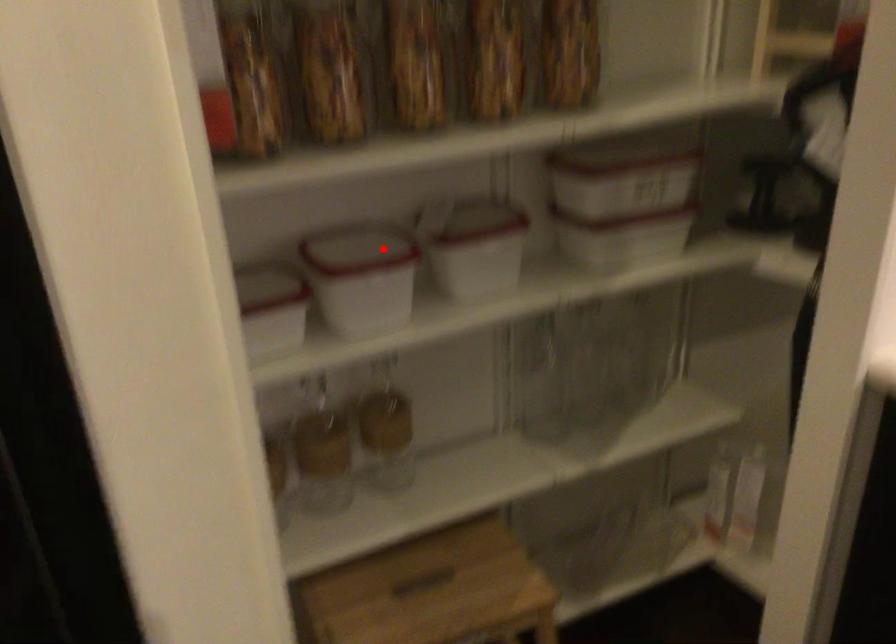
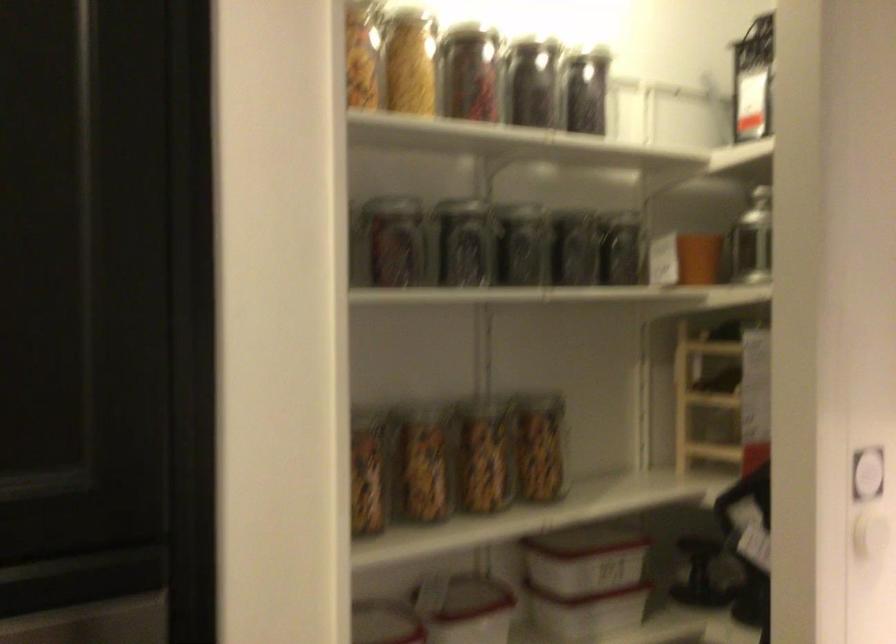
Question: A red point is marked in image1. In image2, is the corresponding 3D point closer to the camera or farther? Reply with the corresponding letter.

Choices:
 (A) The corresponding 3D point is closer.
 (B) The corresponding 3D point is farther.

Answer: (B)